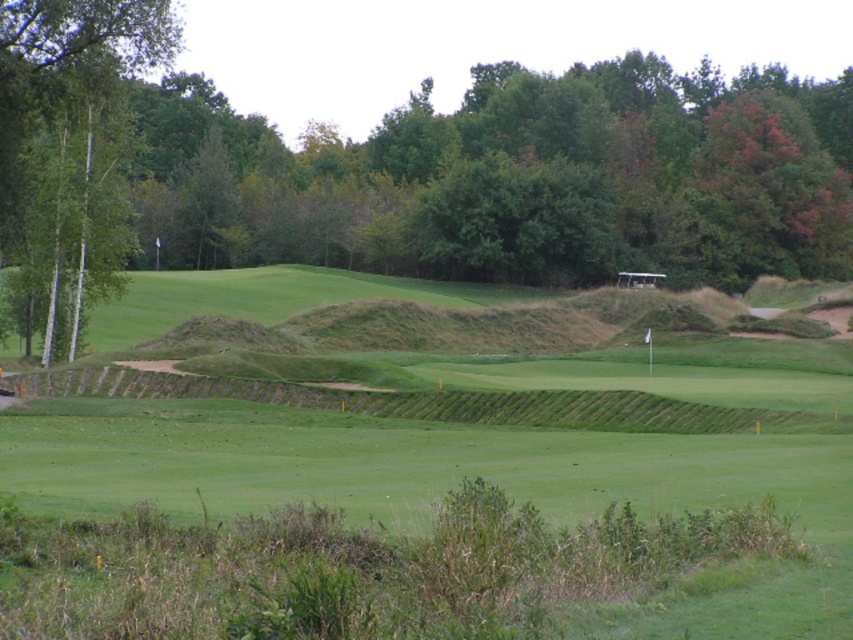
You are a golfer standing on the green grassy golf course at center. You want to hit a ball towards the green leafy tree at center. In which direction should you aim?

You should aim to the right because the green leafy tree at center is to the right of the green grassy golf course at center.

You are a golfer standing on the green grassy golf course at center and want to hit the ball towards the green leafy tree at left. Which direction should you aim?

The green grassy golf course at center is to the right of the green leafy tree at left, so you should aim to the left to hit the ball towards the green leafy tree at left.

You are a golfer standing at the point labeled point (x=27, y=19). You want to hit a ball to the point labeled point (x=792, y=499). Considering the golf course layout described, will your target point be visible from your current position?

Point (x=792, y=499) is in front of point (x=27, y=19), so yes, the target point will be visible from your current position.